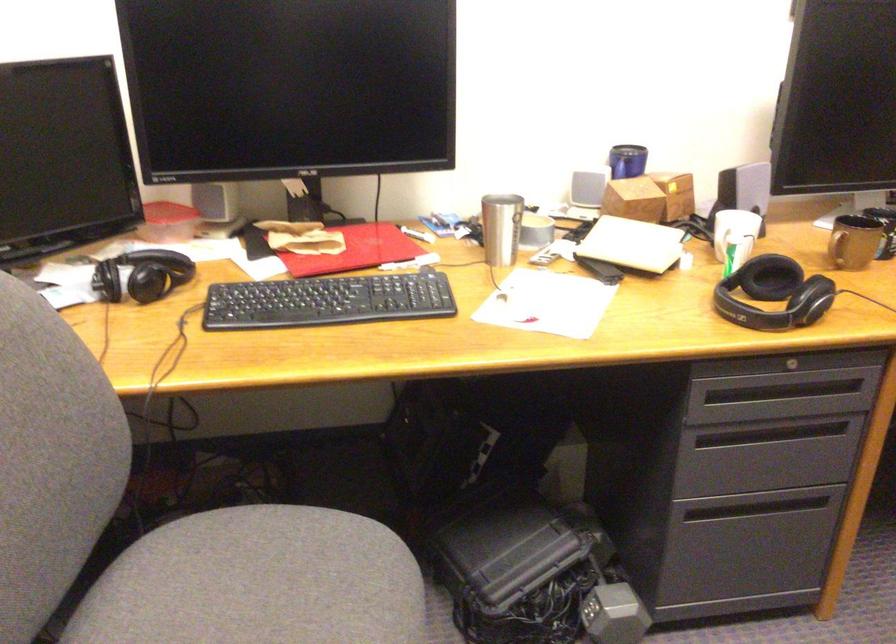
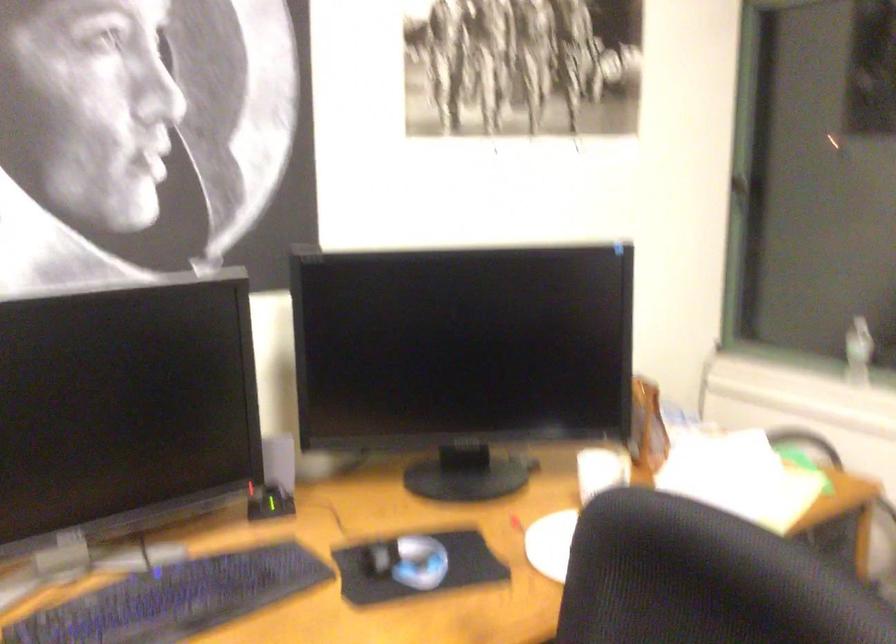
Question: Which direction would the cameraman need to move to produce the second image? Reply with the corresponding letter.

Choices:
 (A) Left
 (B) Right
 (C) Forward
 (D) Backward

Answer: (B)